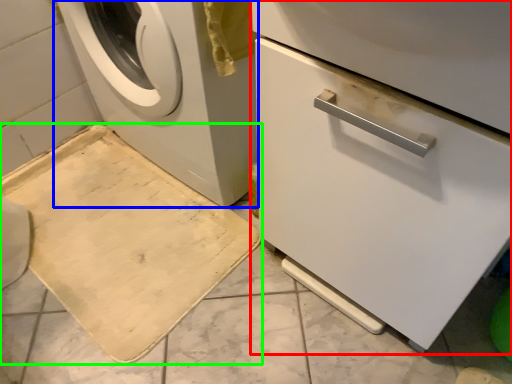
Question: Based on their relative distances, which object is farther from machine (highlighted by a red box)? Choose from washing machine (highlighted by a blue box) and bath mat (highlighted by a green box).

Choices:
 (A) washing machine
 (B) bath mat

Answer: (B)